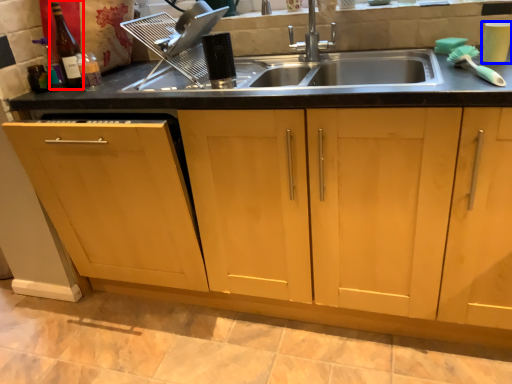
Question: Among these objects, which one is farthest to the camera, bottle (highlighted by a red box) or appliance (highlighted by a blue box)?

Choices:
 (A) bottle
 (B) appliance

Answer: (A)